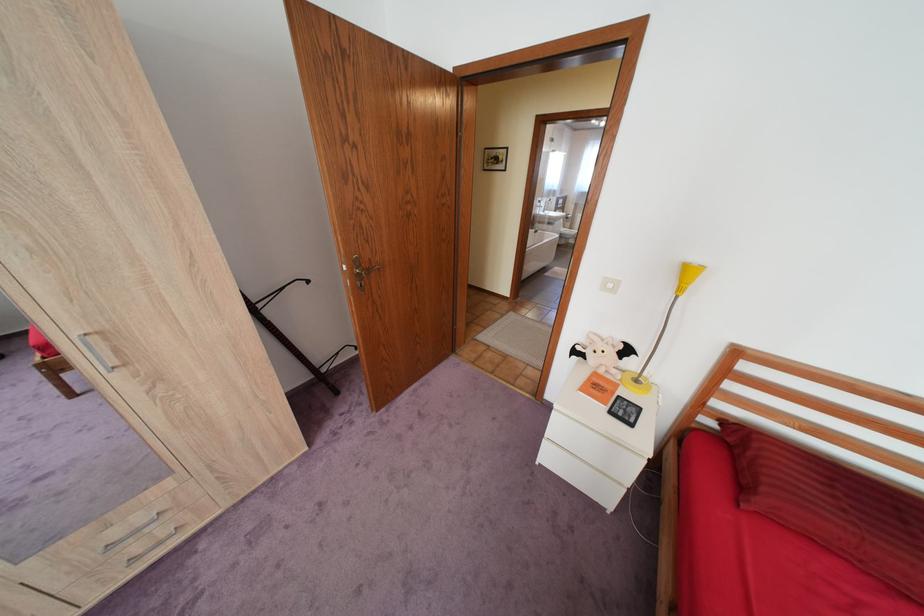
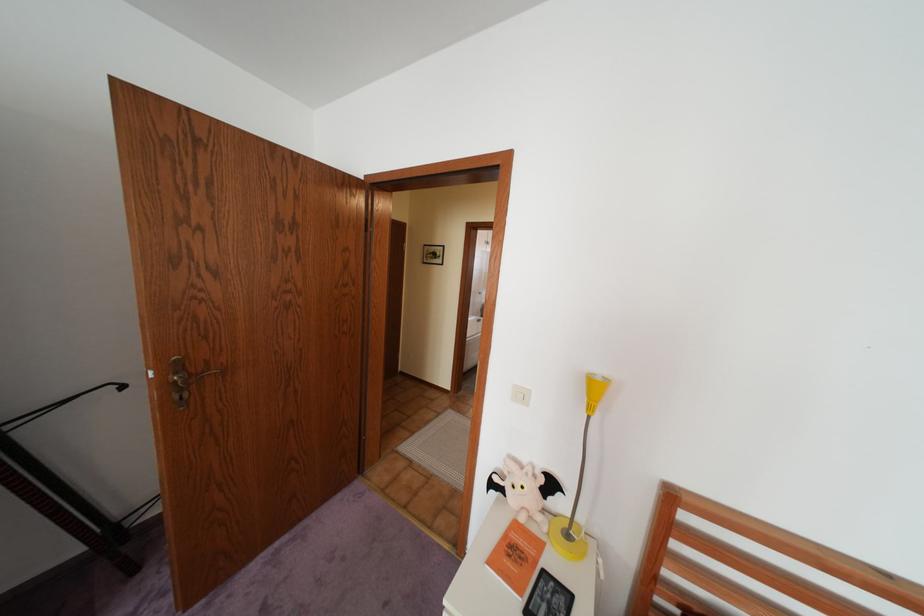
Question: The images are taken continuously from a first-person perspective. In which direction is your viewpoint rotating?

Choices:
 (A) Left
 (B) Right
 (C) Up
 (D) Down

Answer: (C)